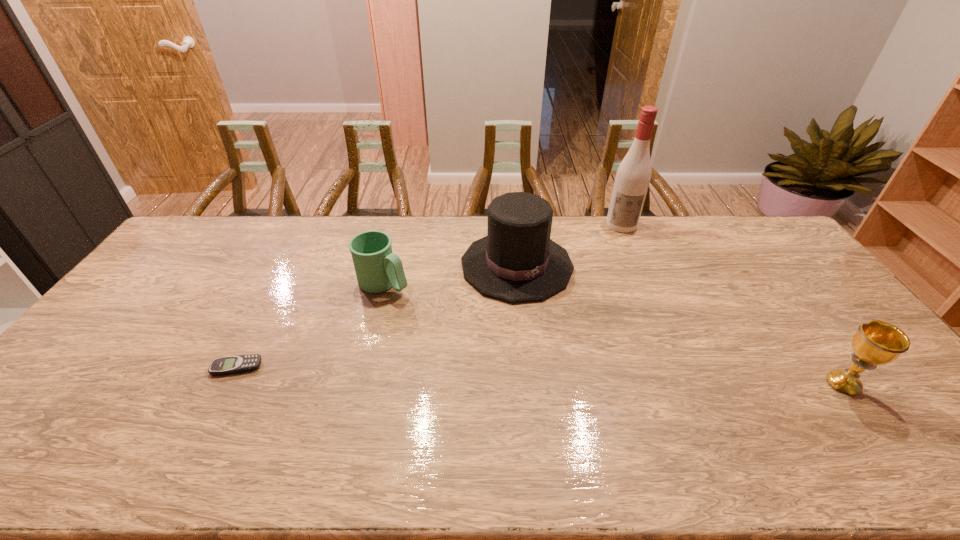
Identify the location of free space located 0.130m on the left of the shortest object. (164, 367).

Where is `vacant space located 0.110m on the right of the rightmost object`? The height and width of the screenshot is (540, 960). vacant space located 0.110m on the right of the rightmost object is located at coordinates (904, 384).

The height and width of the screenshot is (540, 960). I want to click on vacant space located on the side of the fourth object from right to left with the handle, so click(x=425, y=306).

Image resolution: width=960 pixels, height=540 pixels. I want to click on free space located 0.100m on the side of the fourth object from right to left with the handle, so click(x=427, y=307).

Where is `blank space located 0.260m on the side of the fourth object from right to left with the handle`? This screenshot has height=540, width=960. blank space located 0.260m on the side of the fourth object from right to left with the handle is located at coordinates (468, 330).

At what (x,y) coordinates should I click in order to perform the action: click on free space located 0.250m on the front of the dress hat with the decoration. Please return your answer as a coordinate pair (x, y). Looking at the image, I should click on (588, 361).

Identify the location of blank space located 0.200m on the front of the dress hat with the decoration. The image size is (960, 540). (578, 348).

Find the location of a particular element. free location located 0.300m on the front of the dress hat with the decoration is located at coordinates (598, 376).

Image resolution: width=960 pixels, height=540 pixels. What are the coordinates of `free spot located 0.380m on the label of the second object from right to left` in the screenshot? It's located at (622, 303).

Locate an element on the screen. Image resolution: width=960 pixels, height=540 pixels. vacant point located 0.150m on the label of the second object from right to left is located at coordinates (622, 258).